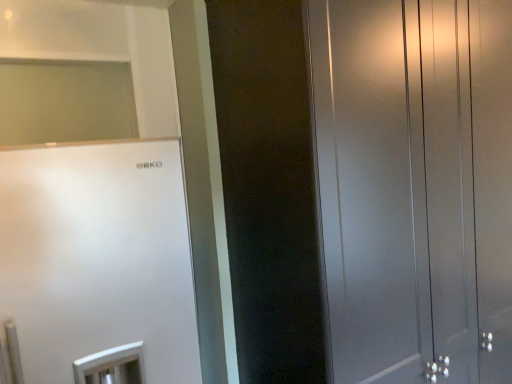
Question: In terms of height, does satin white fridge at left look taller or shorter compared to satin black wardrobe at right?

Choices:
 (A) short
 (B) tall

Answer: (A)

Question: From a real-world perspective, is satin white fridge at left above or below satin black wardrobe at right?

Choices:
 (A) above
 (B) below

Answer: (B)

Question: Visually, is satin white fridge at left positioned to the left or to the right of satin black wardrobe at right?

Choices:
 (A) right
 (B) left

Answer: (B)

Question: Is satin black wardrobe at right spatially inside satin white fridge at left, or outside of it?

Choices:
 (A) outside
 (B) inside

Answer: (A)

Question: Considering the positions of satin black wardrobe at right and satin white fridge at left in the image, is satin black wardrobe at right taller or shorter than satin white fridge at left?

Choices:
 (A) tall
 (B) short

Answer: (A)

Question: From the image's perspective, is satin black wardrobe at right positioned above or below satin white fridge at left?

Choices:
 (A) below
 (B) above

Answer: (B)

Question: Considering the relative positions of satin black wardrobe at right and satin white fridge at left in the image provided, is satin black wardrobe at right to the left or to the right of satin white fridge at left?

Choices:
 (A) right
 (B) left

Answer: (A)